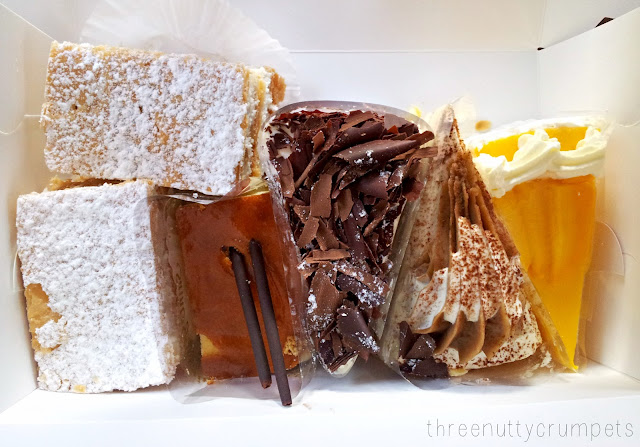
This screenshot has width=640, height=447. I want to click on box, so click(x=440, y=99).